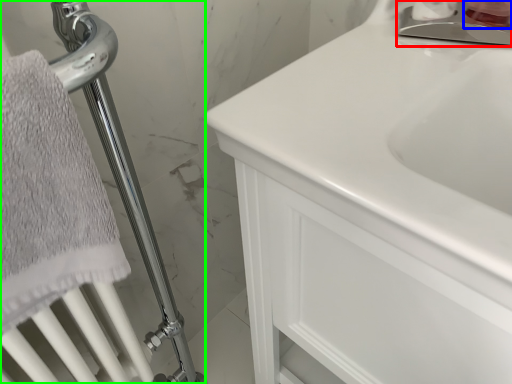
Question: Which object is positioned farthest from faucet (highlighted by a red box)? Select from toiletry (highlighted by a blue box) and shower (highlighted by a green box).

Choices:
 (A) toiletry
 (B) shower

Answer: (B)